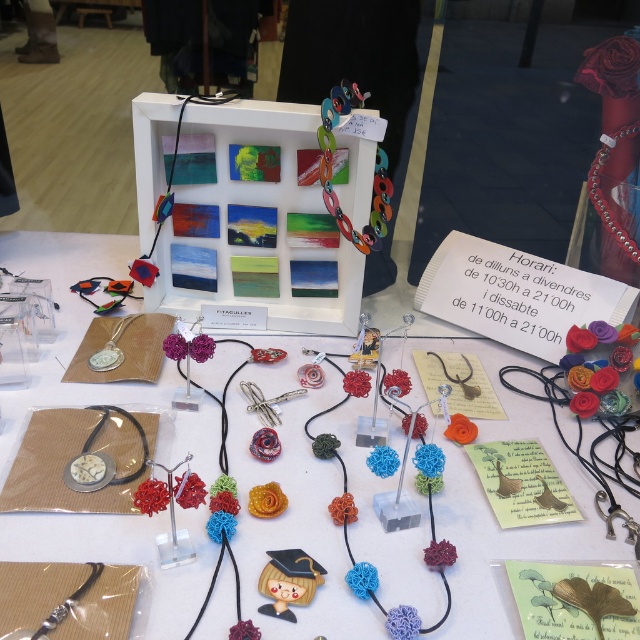
You are a customer in the shop and want to touch both the point at position (600,138) and the point at position (132,317). Which point will you reach first if you move towards them from your current position?

The point at position (600,138) is closer to you than the point at position (132,317), so you will reach it first.

You are a customer in the shop and want to place the silver metallic bracelet at lower left on the white matte table at center. Will it fit?

The white matte table at center is bigger than the silver metallic bracelet at lower left, so yes, the bracelet will fit on the table.